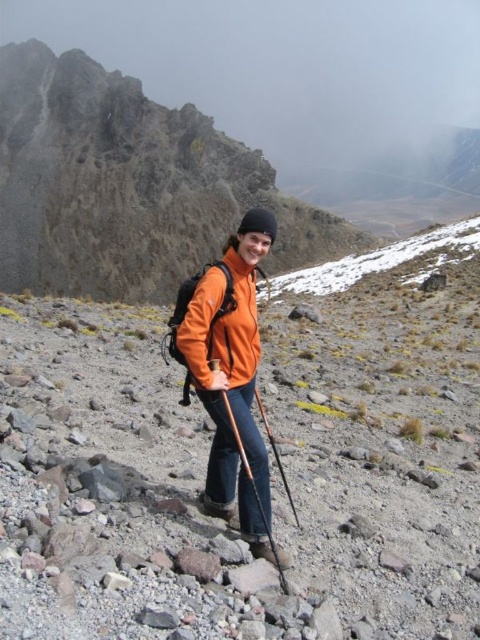
Which is behind, point (268, 525) or point (272, 448)?

The point (272, 448) is behind.

Is brown wood ski pole at center to the right of orange fiberglass ski pole at center from the viewer's perspective?

No, brown wood ski pole at center is not to the right of orange fiberglass ski pole at center.

The image size is (480, 640). What are the coordinates of `brown wood ski pole at center` in the screenshot? It's located at (254, 490).

Can you confirm if orange fabric jacket at center is positioned above orange softshell jacket at center?

Yes.

Looking at this image, who is more distant from viewer, (370,330) or (216,328)?

Point (370,330)

The image size is (480, 640). In order to click on orange fabric jacket at center in this screenshot , I will do `click(269, 464)`.

The width and height of the screenshot is (480, 640). I want to click on rugged rock mountain at upper left, so click(128, 186).

Which is behind, point (32, 186) or point (238, 264)?

The point (32, 186) is behind.

Where is `rugged rock mountain at upper left`? This screenshot has width=480, height=640. rugged rock mountain at upper left is located at coordinates (128, 186).